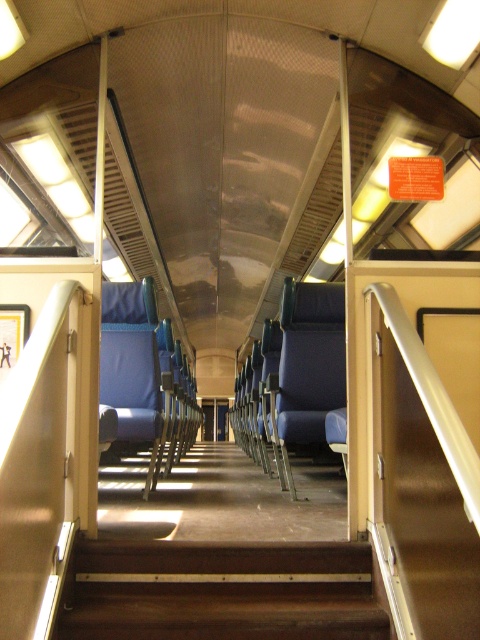
Which is in front, point (334, 320) or point (143, 388)?

Positioned in front is point (143, 388).

Describe the element at coordinates (308, 365) in the screenshot. I see `blue fabric seat at center` at that location.

The image size is (480, 640). I want to click on blue fabric seat at center, so click(x=308, y=365).

Does point (308, 556) come farther from viewer compared to point (124, 316)?

No, (308, 556) is closer to viewer.

Find the location of a particular element. The width and height of the screenshot is (480, 640). brown wooden stairs at center is located at coordinates (219, 592).

Who is more distant from viewer, (362, 634) or (103, 292)?

The point (103, 292) is behind.

At what (x,y) coordinates should I click in order to perform the action: click on brown wooden stairs at center. Please return your answer as a coordinate pair (x, y). Looking at the image, I should click on (219, 592).

Does point (227, 563) come closer to viewer compared to point (274, 419)?

That is True.

Does brown wooden stairs at center lie behind blue fabric seat at center?

That is False.

In order to click on brown wooden stairs at center in this screenshot , I will do coord(219,592).